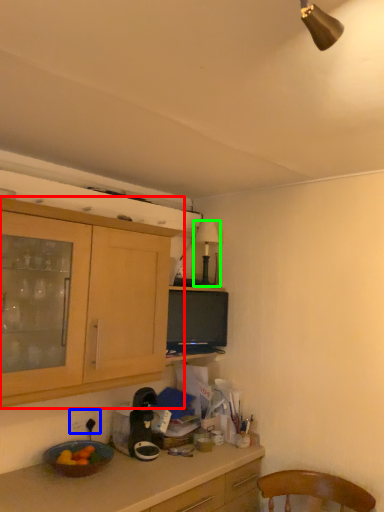
Question: Considering the real-world distances, which object is farthest from cabinetry (highlighted by a red box)? power outlet (highlighted by a blue box) or lamp (highlighted by a green box)?

Choices:
 (A) power outlet
 (B) lamp

Answer: (B)